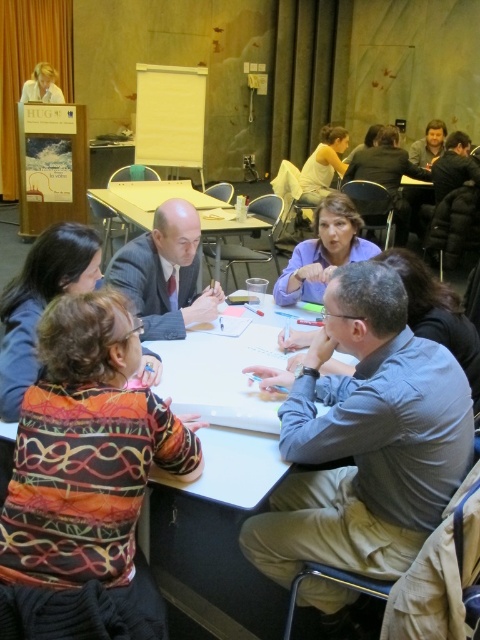
Question: Considering the relative positions of matte black suit at center and white plastic table at center in the image provided, where is matte black suit at center located with respect to white plastic table at center?

Choices:
 (A) left
 (B) right

Answer: (A)

Question: Can you confirm if matte black suit at center is bigger than matte white shirt at upper left?

Choices:
 (A) no
 (B) yes

Answer: (B)

Question: Which point appears farthest from the camera in this image?

Choices:
 (A) (244, 228)
 (B) (145, 282)
 (C) (43, 83)

Answer: (C)

Question: Does light blue shirt at center come in front of knitted sweater at center?

Choices:
 (A) yes
 (B) no

Answer: (B)

Question: Which of the following is the closest to the observer?

Choices:
 (A) white plastic table at center
 (B) light blue shirt at center
 (C) matte black suit at center

Answer: (B)

Question: Based on their relative distances, which object is nearer to the light blue shirt at center?

Choices:
 (A) matte white shirt at upper left
 (B) white plastic table at center
 (C) knitted sweater at center

Answer: (C)